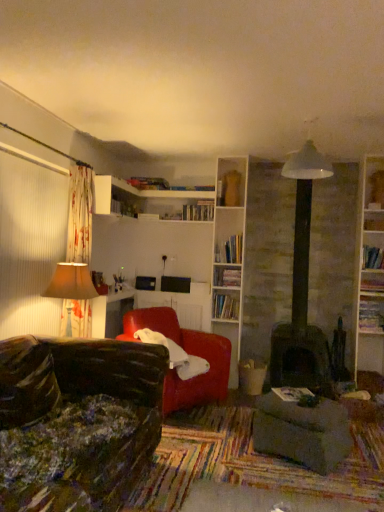
Question: Is hardcover books at center, the 8th book positioned from the bottom, wider or thinner than hardcover book at center, which is the fifth book from top to bottom?

Choices:
 (A) wide
 (B) thin

Answer: (B)

Question: Is hardcover books at center, the 3th book positioned from the left, taller or shorter than hardcover book at center, the sixth book from the right?

Choices:
 (A) short
 (B) tall

Answer: (A)

Question: Which object is positioned closest to the hardcover book at right, which ranks as the fourth book in right-to-left order?

Choices:
 (A) hardcover book at center, placed as the 7th book when sorted from right to left
 (B) white glossy bookshelf at upper center
 (C) hardcover book at upper right, placed as the 9th book when sorted from left to right
 (D) hardcover book at upper center, positioned as the tenth book in right-to-left order
 (E) hardcover book at right, which is counted as the seventh book, starting from the top

Answer: (E)

Question: Which of these objects is positioned farthest from the hardcover book at upper right, which is counted as the 6th book, starting from the top?

Choices:
 (A) hardcover book at right, placed as the 3th book when sorted from right to left
 (B) hardcover book at center, the fifth book from the right
 (C) white glossy bookshelf at upper center
 (D) dark gray fabric footrest at lower right
 (E) hardcover book at center, which is counted as the 5th book, starting from the left

Answer: (C)